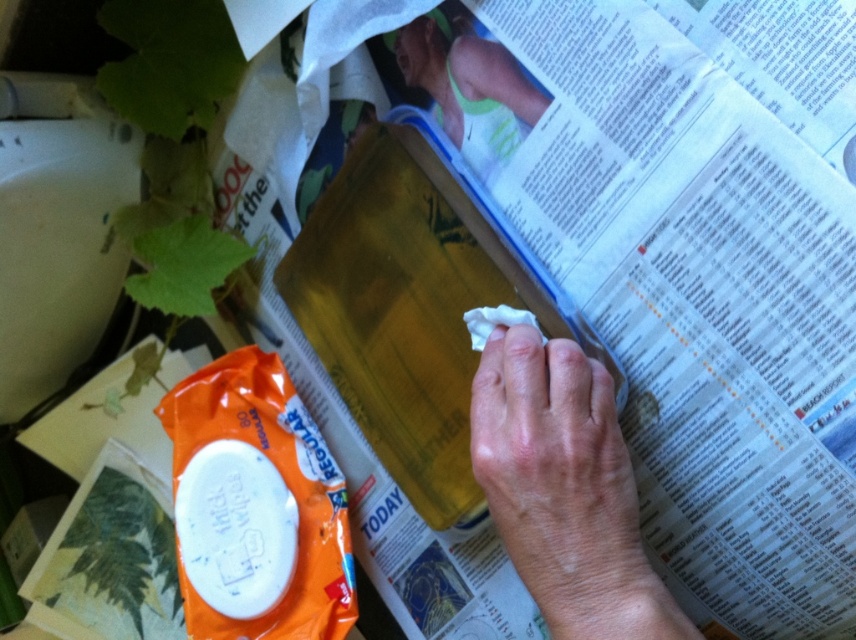
You are observing a person in a casual setting. You notice the dry skin at center and the skinny green tank top at upper center. Which object is taller?

The dry skin at center is taller than the skinny green tank top at upper center.

You are a fashion designer observing the image. You need to place a new accessory between the dry skin at center and the skinny green tank top at upper center. Where should you place it?

The dry skin at center is located below the skinny green tank top at upper center, so you should place the accessory between them, either above the dry skin at center or below the skinny green tank top at upper center to ensure it fits in the space between.